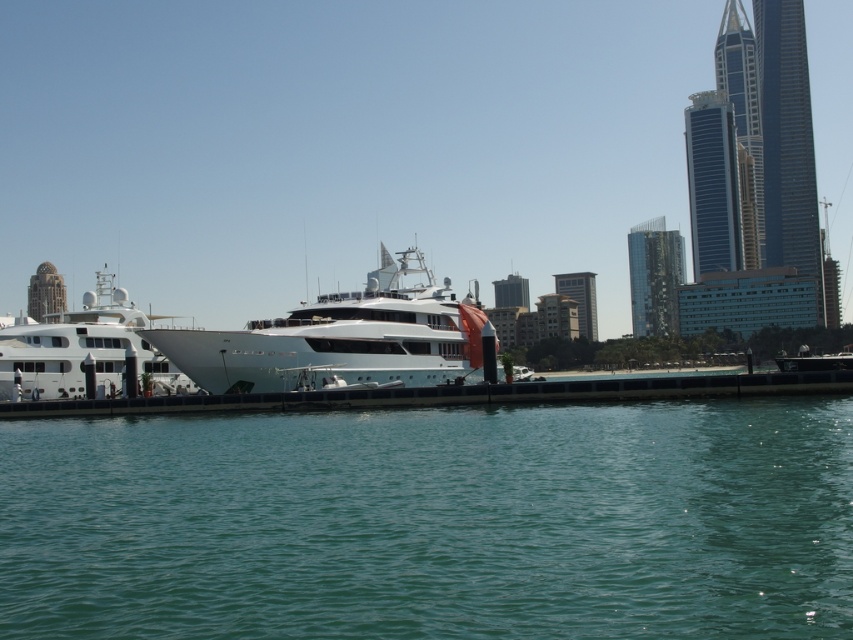
Does clear blue water at lower center have a greater height compared to white glossy yacht at center?

No.

Does clear blue water at lower center have a smaller size compared to white glossy yacht at center?

Indeed, clear blue water at lower center has a smaller size compared to white glossy yacht at center.

In order to click on clear blue water at lower center in this screenshot , I will do `click(433, 522)`.

Is point (270, 326) closer to viewer compared to point (9, 362)?

Yes, it is in front of point (9, 362).

Is white glossy yacht at center shorter than white glossy yacht at left?

Yes, white glossy yacht at center is shorter than white glossy yacht at left.

Is point (258, 365) in front of point (160, 369)?

Yes, point (258, 365) is closer to viewer.

Where is `white glossy yacht at center`? Image resolution: width=853 pixels, height=640 pixels. white glossy yacht at center is located at coordinates (340, 339).

Is clear blue water at lower center to the left of white glossy yacht at left from the viewer's perspective?

No, clear blue water at lower center is not to the left of white glossy yacht at left.

Consider the image. Does clear blue water at lower center appear over white glossy yacht at left?

Incorrect, clear blue water at lower center is not positioned above white glossy yacht at left.

Identify the location of clear blue water at lower center. The width and height of the screenshot is (853, 640). (433, 522).